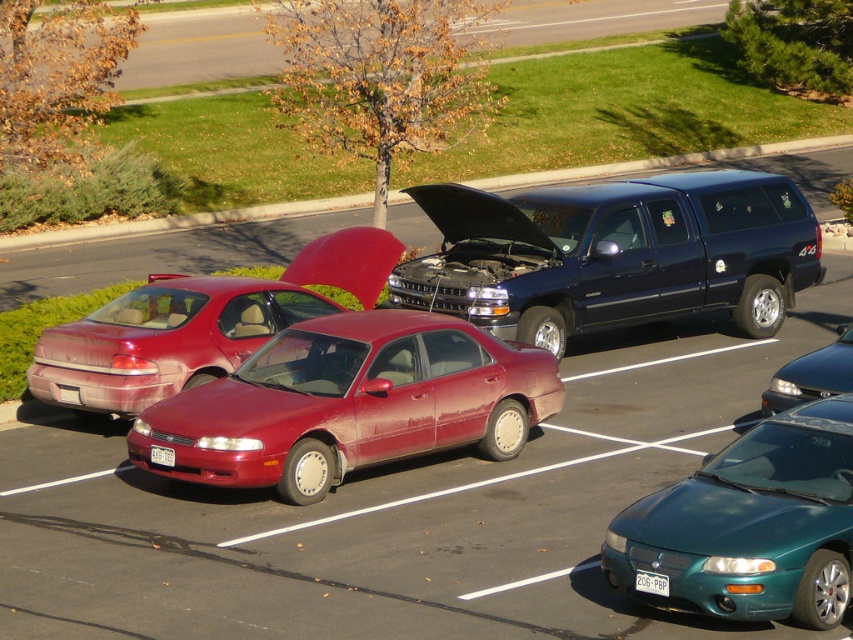
Question: Is shiny dark blue suv at center to the right of metallic gray sedan at lower right from the viewer's perspective?

Choices:
 (A) no
 (B) yes

Answer: (A)

Question: Which point is farther to the camera?

Choices:
 (A) (268, 330)
 (B) (842, 384)

Answer: (A)

Question: Which point appears farthest from the camera in this image?

Choices:
 (A) (149, 460)
 (B) (80, 333)
 (C) (207, 429)

Answer: (B)

Question: Is teal glossy sedan at lower right further to the viewer compared to metallic gray sedan at lower right?

Choices:
 (A) yes
 (B) no

Answer: (B)

Question: Which object appears farthest from the camera in this image?

Choices:
 (A) rusty matte sedan at center
 (B) metallic gray sedan at lower right

Answer: (A)

Question: Can you confirm if teal glossy sedan at lower right is positioned to the left of rusty matte sedan at center?

Choices:
 (A) yes
 (B) no

Answer: (B)